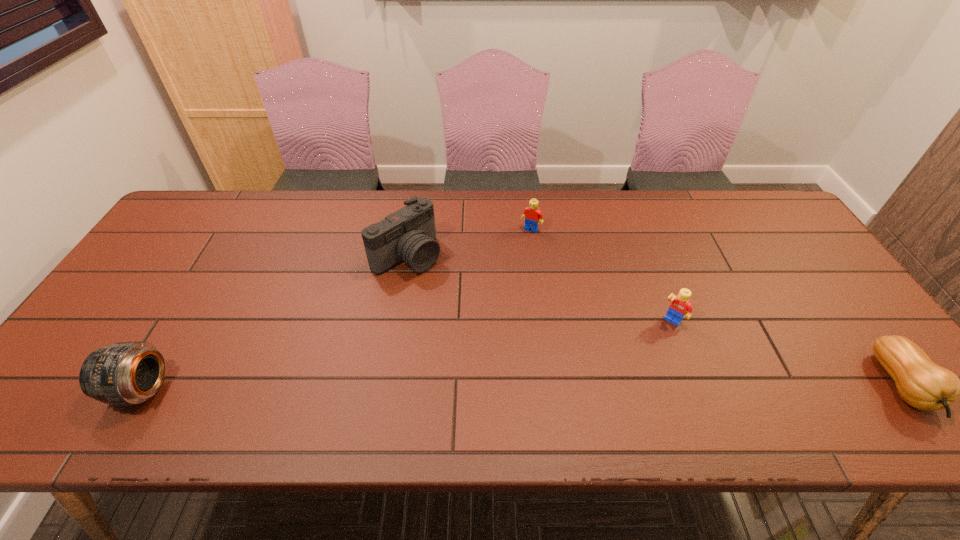
This screenshot has height=540, width=960. Find the location of `camera at the far edge`. camera at the far edge is located at coordinates (408, 235).

Identify the location of Lego at the far edge. This screenshot has width=960, height=540. (532, 214).

Locate an element on the screen. The width and height of the screenshot is (960, 540). telephoto lens located in the near edge section of the desktop is located at coordinates (125, 373).

Find the location of a particular element. Image resolution: width=960 pixels, height=540 pixels. gourd located at the near edge is located at coordinates (921, 383).

This screenshot has width=960, height=540. I want to click on object that is positioned at the left edge, so click(125, 373).

At what (x,y) coordinates should I click in order to perform the action: click on object at the right edge. Please return your answer as a coordinate pair (x, y). This screenshot has height=540, width=960. Looking at the image, I should click on (921, 383).

Find the location of `object positioned at the near left corner`. object positioned at the near left corner is located at coordinates (125, 373).

Locate an element on the screen. This screenshot has width=960, height=540. object located at the near right corner is located at coordinates (921, 383).

Locate an element on the screen. This screenshot has width=960, height=540. vacant region at the far edge of the desktop is located at coordinates (666, 207).

In the image, there is a desktop. At what (x,y) coordinates should I click in order to perform the action: click on vacant space at the near edge. Please return your answer as a coordinate pair (x, y). Looking at the image, I should click on (480, 373).